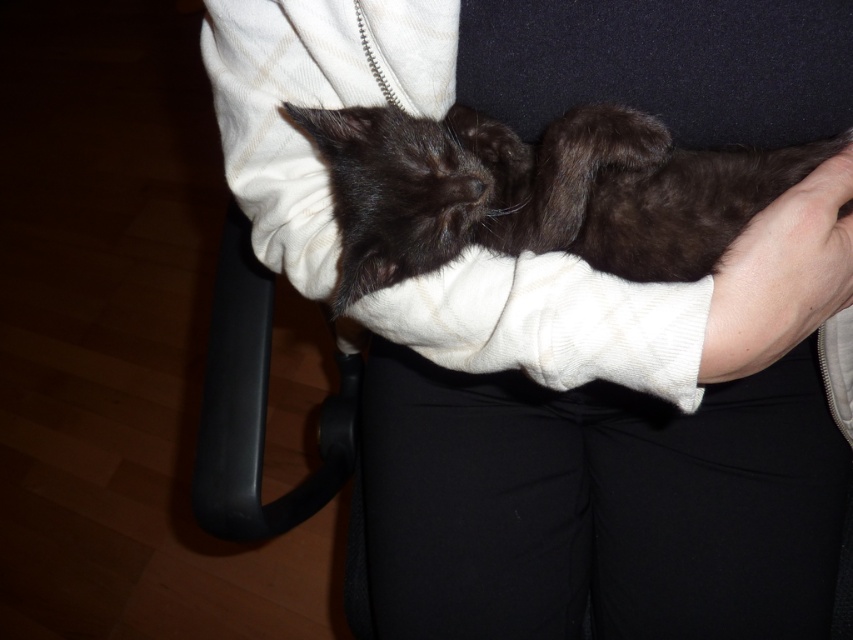
Measure the distance between black fluffy cat at center and camera.

A distance of 25.36 inches exists between black fluffy cat at center and camera.

Is black fluffy cat at center in front of black plastic armrest at lower left?

Yes.

Between point (352, 296) and point (352, 365), which one is positioned behind?

The point (352, 365) is behind.

Identify the location of black fluffy cat at center. (537, 192).

Is black fluffy cat at center wider than smooth skin at lower right?

Yes, black fluffy cat at center is wider than smooth skin at lower right.

Does black fluffy cat at center appear on the left side of smooth skin at lower right?

Correct, you'll find black fluffy cat at center to the left of smooth skin at lower right.

Is point (339, 195) positioned in front of point (828, 298)?

No, (339, 195) is behind (828, 298).

Find the location of a particular element. The width and height of the screenshot is (853, 640). black fluffy cat at center is located at coordinates (537, 192).

Can you confirm if black plastic armrest at lower left is bigger than smooth skin at lower right?

Yes.

Locate an element on the screen. This screenshot has height=640, width=853. black plastic armrest at lower left is located at coordinates (257, 406).

In order to click on black plastic armrest at lower left in this screenshot , I will do `click(257, 406)`.

What are the coordinates of `black plastic armrest at lower left` in the screenshot? It's located at (257, 406).